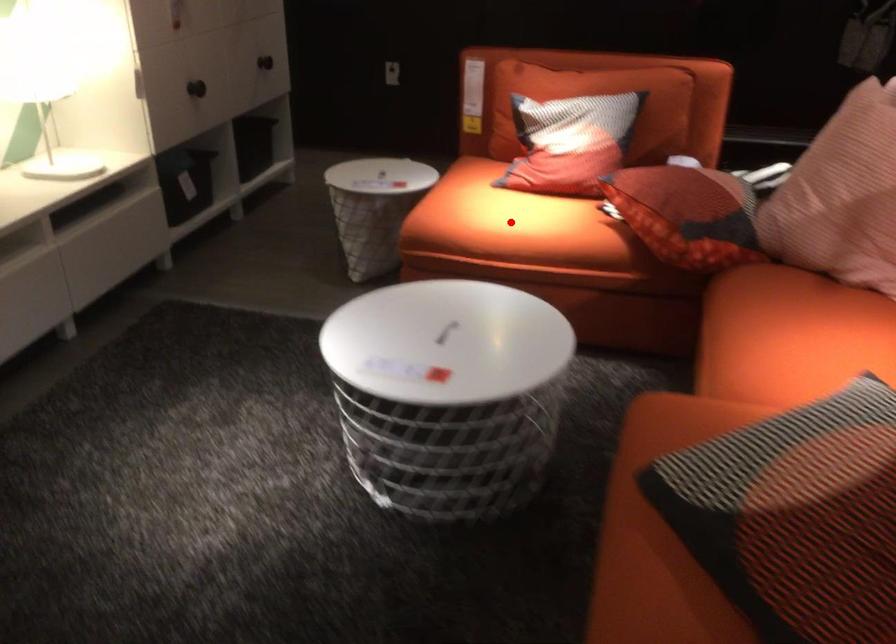
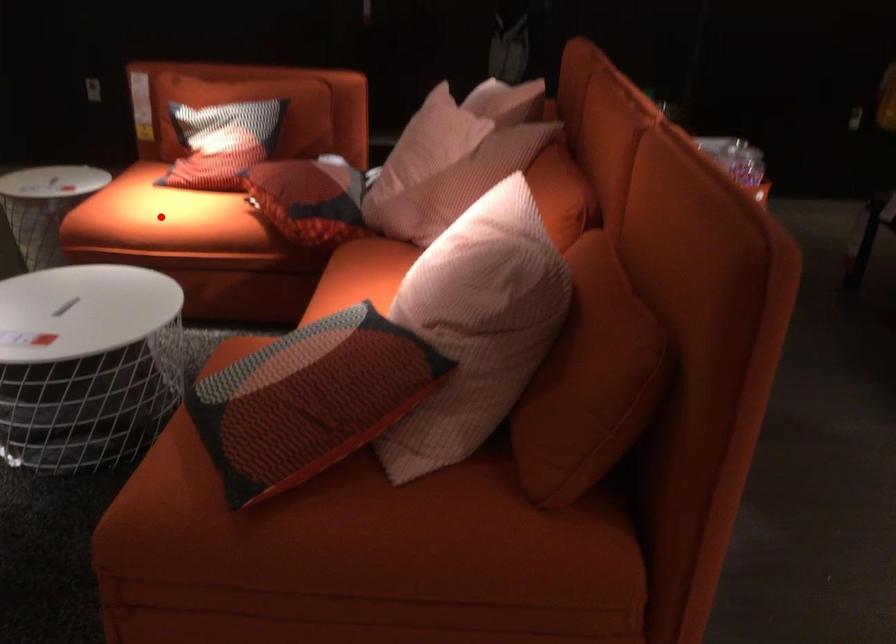
I am providing you with two images of the same scene from different viewpoints. A red point is marked on the first image and another point is marked on the second image. Does the point marked in image1 correspond to the same location as the one in image2?

Yes